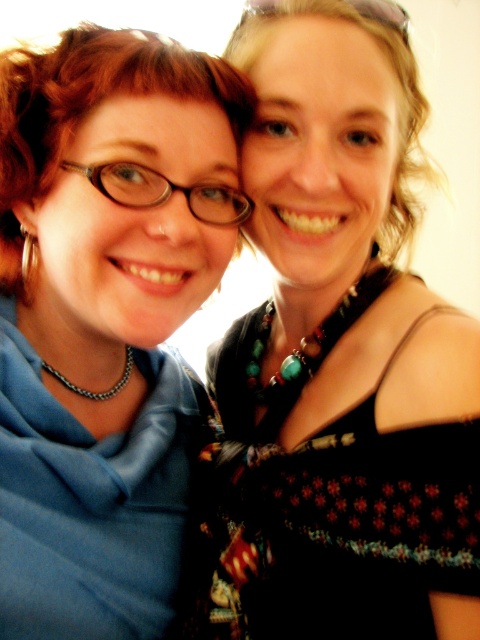
You are taking a photo of two people standing in front of you. You notice two specific points on their bodies marked as point (x=62, y=339) and point (x=251, y=570). If you want to ensure both points are visible in the photo, which point should be closer to the camera?

Point (x=251, y=570) should be closer to the camera because point (x=62, y=339) is behind it, so to ensure both are visible, the front point needs to be nearer.

You are planning to buy a new scarf and a dress for a party. The store has a limited space in the display. The display can only accommodate items with a width of 50 cm or less. Based on the image, will both the matte blue scarf at left and the black textured dress at upper right fit in the display?

The matte blue scarf at left is wider than the black textured dress at upper right. Since the display can only accommodate items up to 50 cm in width, we need to check both widths. However, without exact measurements, we can only infer that if the dress is under 50 cm, the scarf might exceed it. Therefore, it is uncertain if both will fit.